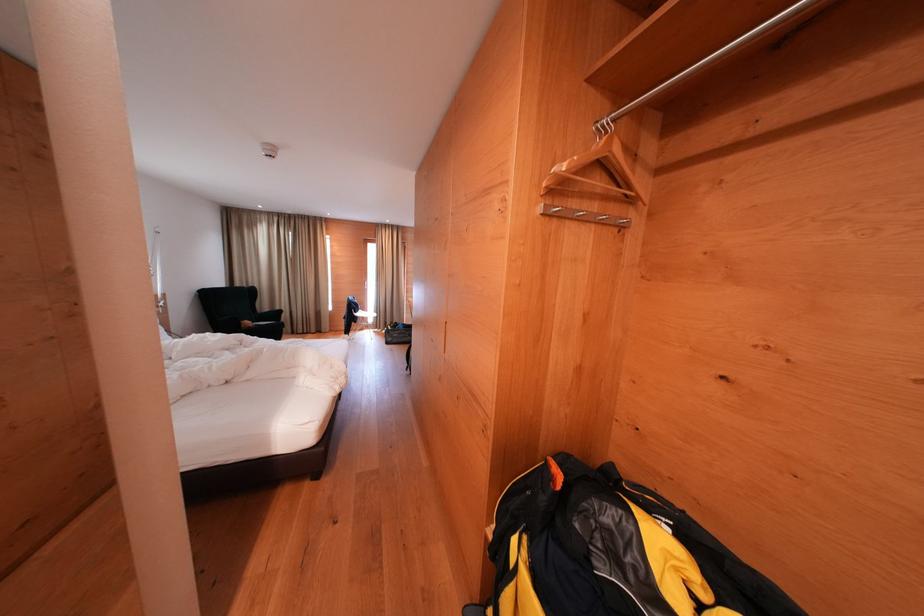
Locate an element on the screen. black chair armrest is located at coordinates (239, 325).